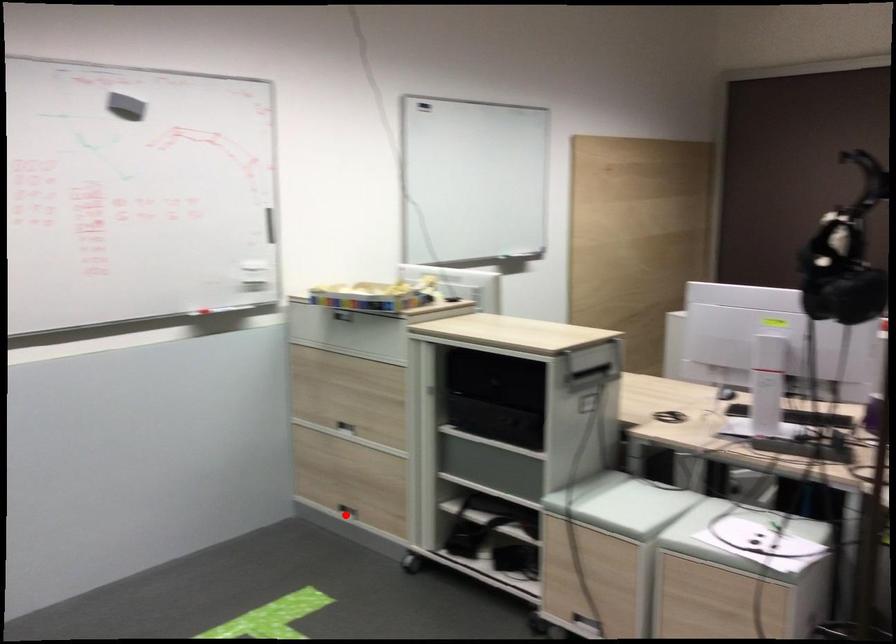
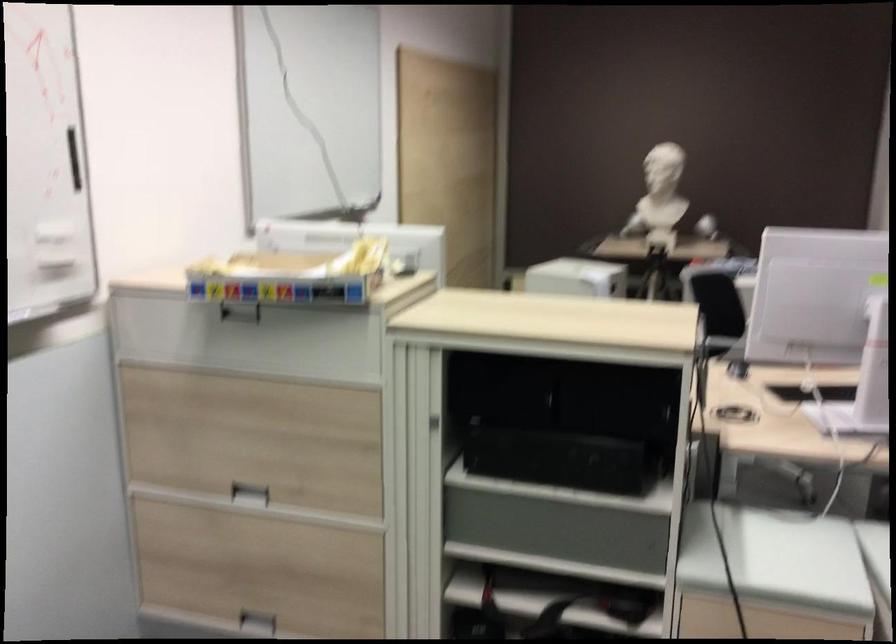
Locate, in the second image, the point that corresponds to the highlighted location in the first image.

(257, 623)